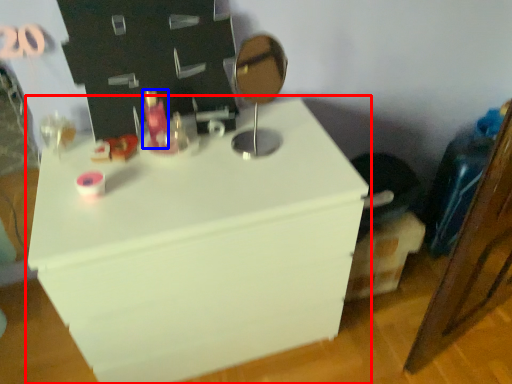
Question: Among these objects, which one is farthest to the camera, furniture (highlighted by a red box) or toiletry (highlighted by a blue box)?

Choices:
 (A) furniture
 (B) toiletry

Answer: (B)